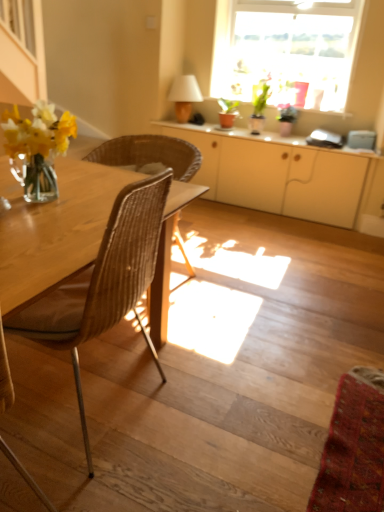
Question: Is matte beige lampshade at upper center completely or partially inside white glossy cabinet at center?

Choices:
 (A) no
 (B) yes

Answer: (A)

Question: Is white glossy cabinet at center facing away from matte beige lampshade at upper center?

Choices:
 (A) yes
 (B) no

Answer: (B)

Question: Is white glossy cabinet at center thinner than matte beige lampshade at upper center?

Choices:
 (A) no
 (B) yes

Answer: (A)

Question: Is white glossy cabinet at center taller than matte beige lampshade at upper center?

Choices:
 (A) no
 (B) yes

Answer: (A)

Question: Is white glossy cabinet at center not within matte beige lampshade at upper center?

Choices:
 (A) no
 (B) yes

Answer: (B)

Question: Looking at the image, does green glossy plant at upper center seem bigger or smaller compared to matte white cabinet at center?

Choices:
 (A) small
 (B) big

Answer: (A)

Question: Do you think green glossy plant at upper center is within matte white cabinet at center, or outside of it?

Choices:
 (A) inside
 (B) outside

Answer: (B)

Question: Is green glossy plant at upper center to the left or to the right of matte white cabinet at center in the image?

Choices:
 (A) left
 (B) right

Answer: (B)

Question: In the image, is green glossy plant at upper center positioned in front of or behind matte white cabinet at center?

Choices:
 (A) front
 (B) behind

Answer: (B)

Question: In terms of size, does green glossy plant at upper center appear bigger or smaller than wooden stairs at lower left?

Choices:
 (A) big
 (B) small

Answer: (B)

Question: In terms of width, does green glossy plant at upper center look wider or thinner when compared to wooden stairs at lower left?

Choices:
 (A) thin
 (B) wide

Answer: (A)

Question: Visually, is green glossy plant at upper center positioned to the left or to the right of wooden stairs at lower left?

Choices:
 (A) left
 (B) right

Answer: (B)

Question: Is green glossy plant at upper center situated inside wooden stairs at lower left or outside?

Choices:
 (A) inside
 (B) outside

Answer: (B)

Question: Considering the positions of wooden stairs at lower left and matte white cabinet at center in the image, is wooden stairs at lower left bigger or smaller than matte white cabinet at center?

Choices:
 (A) big
 (B) small

Answer: (B)

Question: Looking at their shapes, would you say wooden stairs at lower left is wider or thinner than matte white cabinet at center?

Choices:
 (A) thin
 (B) wide

Answer: (B)